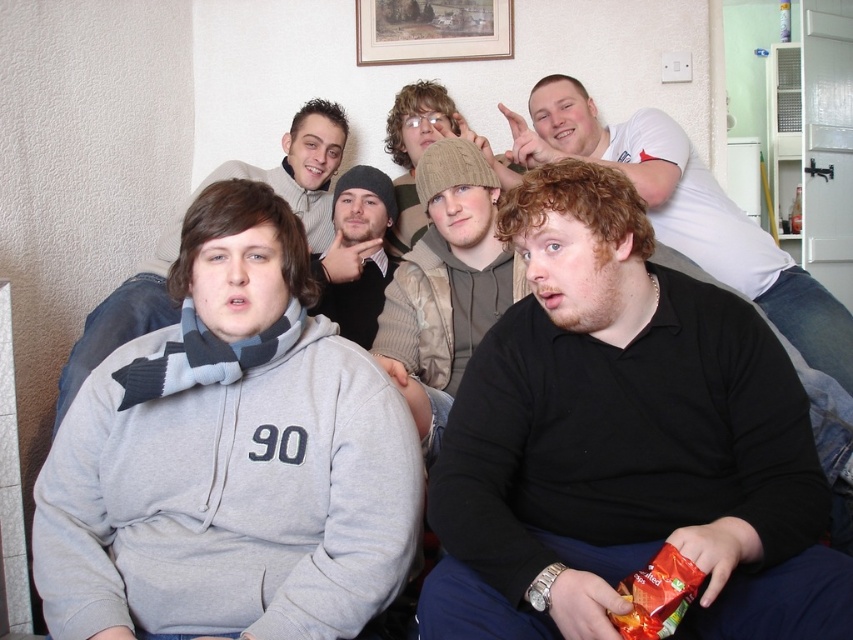
Who is more forward, (201, 208) or (822, 368)?

Positioned in front is point (201, 208).

Which of these two, gray fleece hoodie at left or black matte shirt at lower right, stands shorter?

gray fleece hoodie at left

Measure the distance between point (248, 371) and camera.

Point (248, 371) is 4.30 feet from camera.

The height and width of the screenshot is (640, 853). I want to click on gray fleece hoodie at left, so click(x=229, y=458).

Which is more to the right, gray fleece hoodie at center or black knit cap at center?

From the viewer's perspective, black knit cap at center appears more on the right side.

Who is higher up, gray fleece hoodie at center or black knit cap at center?

gray fleece hoodie at center

The image size is (853, 640). Describe the element at coordinates (305, 177) in the screenshot. I see `gray fleece hoodie at center` at that location.

The image size is (853, 640). I want to click on gray fleece hoodie at center, so click(x=305, y=177).

Does gray fleece hoodie at left have a lesser width compared to gray fleece hoodie at center?

Incorrect, gray fleece hoodie at left's width is not less than gray fleece hoodie at center's.

Can you confirm if gray fleece hoodie at left is shorter than gray fleece hoodie at center?

Yes, gray fleece hoodie at left is shorter than gray fleece hoodie at center.

Image resolution: width=853 pixels, height=640 pixels. I want to click on gray fleece hoodie at left, so click(229, 458).

Locate an element on the screen. The height and width of the screenshot is (640, 853). gray fleece hoodie at left is located at coordinates [229, 458].